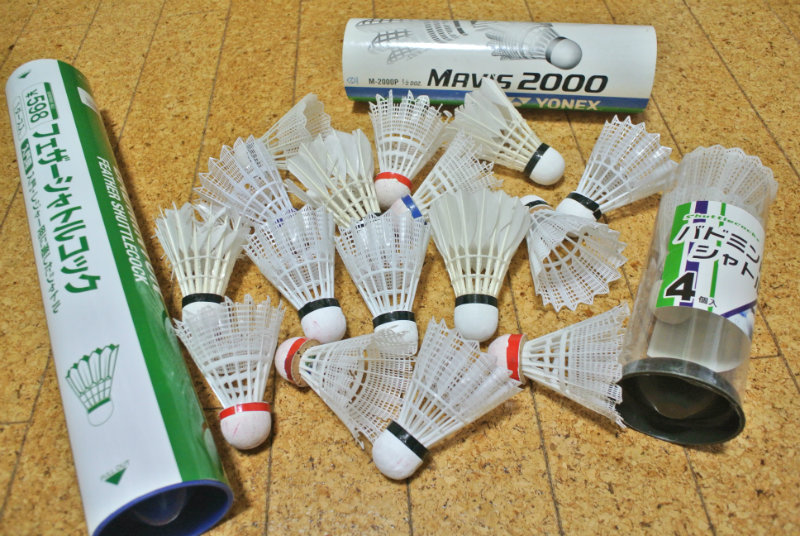
You are a GUI agent. You are given a task and a screenshot of the screen. Output one action in this format:
    pyautogui.click(x=<x>, y=<y>)
    Task: Click on the floor
    The image size is (800, 536).
    Given the screenshot: What is the action you would take?
    pyautogui.click(x=686, y=81)